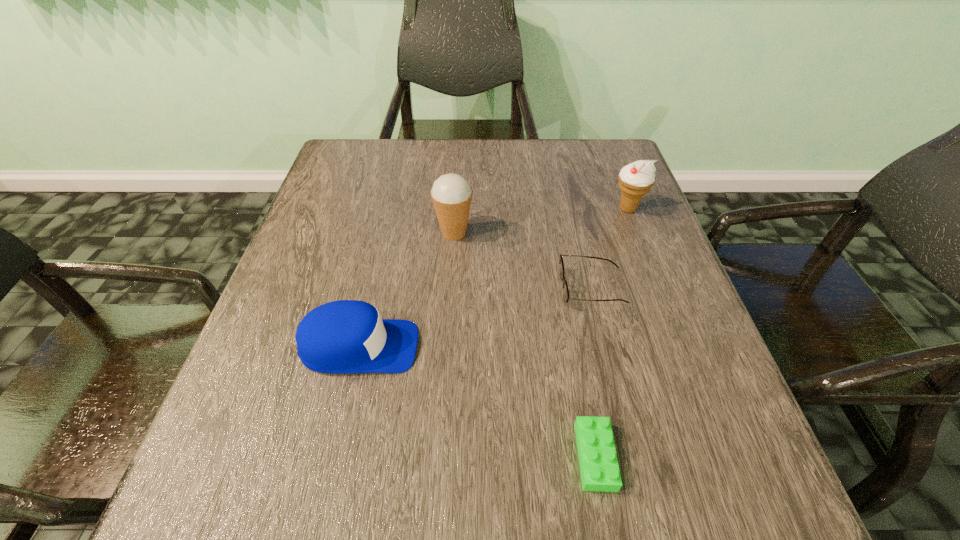
This screenshot has height=540, width=960. What are the coordinates of `free space between the nearest object and the third tallest object` in the screenshot? It's located at click(477, 401).

Identify the location of free point between the baseball cap and the spectacles. (476, 318).

What are the coordinates of `empty space that is in between the second shortest object and the second nearest object` in the screenshot? It's located at (476, 318).

You are a GUI agent. You are given a task and a screenshot of the screen. Output one action in this format:
    pyautogui.click(x=<x>, y=<y>)
    Task: Click on the blank region between the farthest object and the left icecream
    The image size is (960, 540).
    Given the screenshot: What is the action you would take?
    pyautogui.click(x=540, y=221)

Find the location of `free space between the fourth tallest object and the farthest object`. free space between the fourth tallest object and the farthest object is located at coordinates (610, 249).

Where is `vacant area between the second object from left to right and the farthest object`? The height and width of the screenshot is (540, 960). vacant area between the second object from left to right and the farthest object is located at coordinates (540, 221).

You are a GUI agent. You are given a task and a screenshot of the screen. Output one action in this format:
    pyautogui.click(x=<x>, y=<y>)
    Task: Click on the object that is the second closest to the third shortest object
    This screenshot has height=540, width=960.
    Given the screenshot: What is the action you would take?
    pyautogui.click(x=599, y=467)

You are a GUI agent. You are given a task and a screenshot of the screen. Output one action in this format:
    pyautogui.click(x=<x>, y=<y>)
    Task: Click on the object that is the second closest to the Lego
    The image size is (960, 540).
    Given the screenshot: What is the action you would take?
    pyautogui.click(x=346, y=336)

Find the location of a particular element. The width and height of the screenshot is (960, 540). free spot that satisfies the following two spatial constraints: 1. on the face of the third nearest object; 2. on the front side of the nearest object is located at coordinates (633, 456).

Identify the location of free space in the image that satisfies the following two spatial constraints: 1. on the front-facing side of the baseball cap; 2. on the right side of the nearest object. pos(334,456).